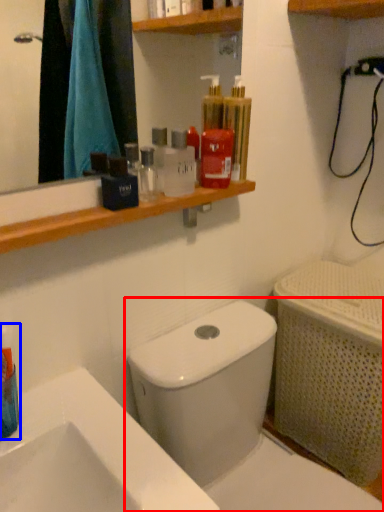
Question: Which point is further to the camera, toilet (highlighted by a red box) or mouthwash (highlighted by a blue box)?

Choices:
 (A) toilet
 (B) mouthwash

Answer: (B)